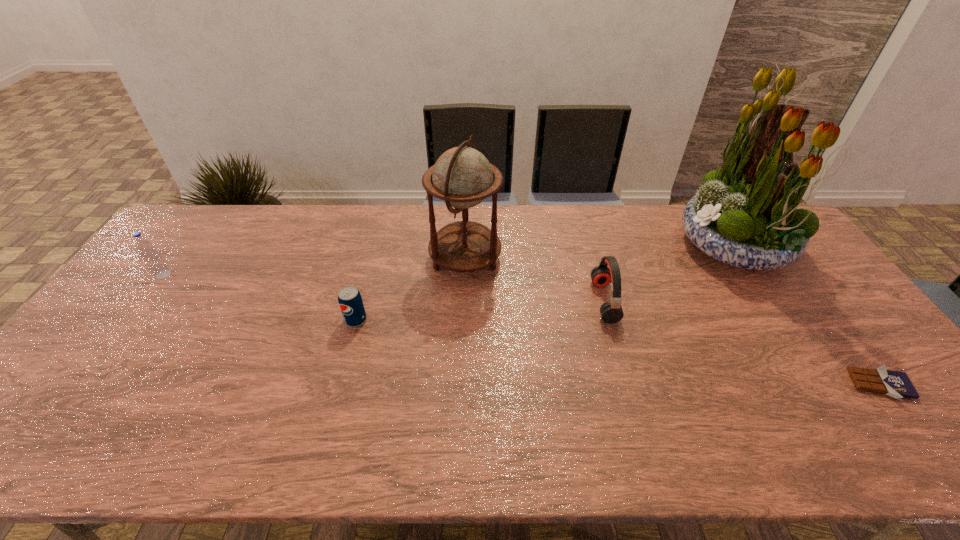
Image resolution: width=960 pixels, height=540 pixels. I want to click on vacant area that lies between the water bottle and the fifth object from right to left, so click(x=259, y=297).

The image size is (960, 540). What are the coordinates of `vacant area between the earphone and the water bottle` in the screenshot? It's located at (384, 288).

Find the location of a particular element. The width and height of the screenshot is (960, 540). free space between the leftmost object and the chocolate bar is located at coordinates (521, 329).

Image resolution: width=960 pixels, height=540 pixels. In order to click on vacant region between the fifth tallest object and the globe in this screenshot , I will do `click(411, 289)`.

Find the location of a particular element. vacant region between the pop and the water bottle is located at coordinates (259, 297).

The width and height of the screenshot is (960, 540). In order to click on free spot between the leftmost object and the pop in this screenshot , I will do `click(259, 297)`.

Locate an element on the screen. This screenshot has width=960, height=540. free spot between the fifth shortest object and the nearest object is located at coordinates pos(673,322).

Where is `vacant area that lies between the nearest object and the leftmost object`? This screenshot has width=960, height=540. vacant area that lies between the nearest object and the leftmost object is located at coordinates (521, 329).

Locate an element on the screen. The height and width of the screenshot is (540, 960). free space between the second object from left to right and the tallest object is located at coordinates (545, 283).

Where is `object that can be found as the third closest to the fourth object from left to right`? This screenshot has height=540, width=960. object that can be found as the third closest to the fourth object from left to right is located at coordinates (896, 384).